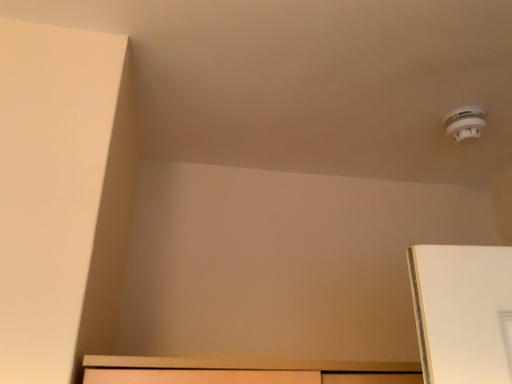
Image resolution: width=512 pixels, height=384 pixels. Describe the element at coordinates (464, 123) in the screenshot. I see `white plastic smoke detector at upper right` at that location.

This screenshot has height=384, width=512. I want to click on white plastic smoke detector at upper right, so click(x=464, y=123).

Find the location of a particular element. This screenshot has width=512, height=384. white plastic smoke detector at upper right is located at coordinates (464, 123).